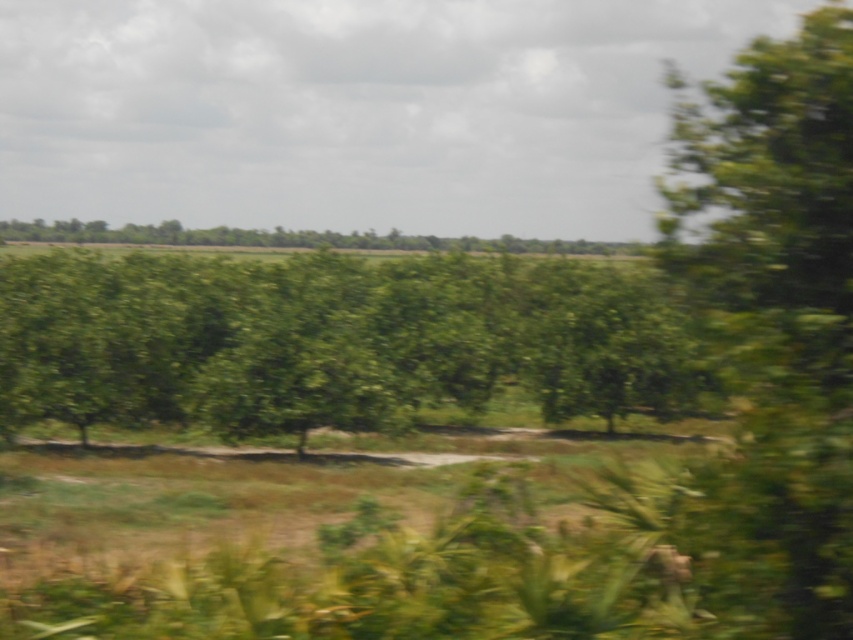
Question: Among these points, which one is nearest to the camera?

Choices:
 (A) (740, 580)
 (B) (500, 342)

Answer: (A)

Question: Does green leafy tree at center appear on the right side of green leafy tree at right?

Choices:
 (A) yes
 (B) no

Answer: (B)

Question: Which point is closer to the camera?

Choices:
 (A) green leafy tree at right
 (B) green leafy tree at center

Answer: (A)

Question: From the image, what is the correct spatial relationship of green leafy tree at center in relation to green leafy tree at right?

Choices:
 (A) left
 (B) right

Answer: (A)

Question: Where is green leafy tree at center located in relation to green leafy tree at right in the image?

Choices:
 (A) right
 (B) left

Answer: (B)